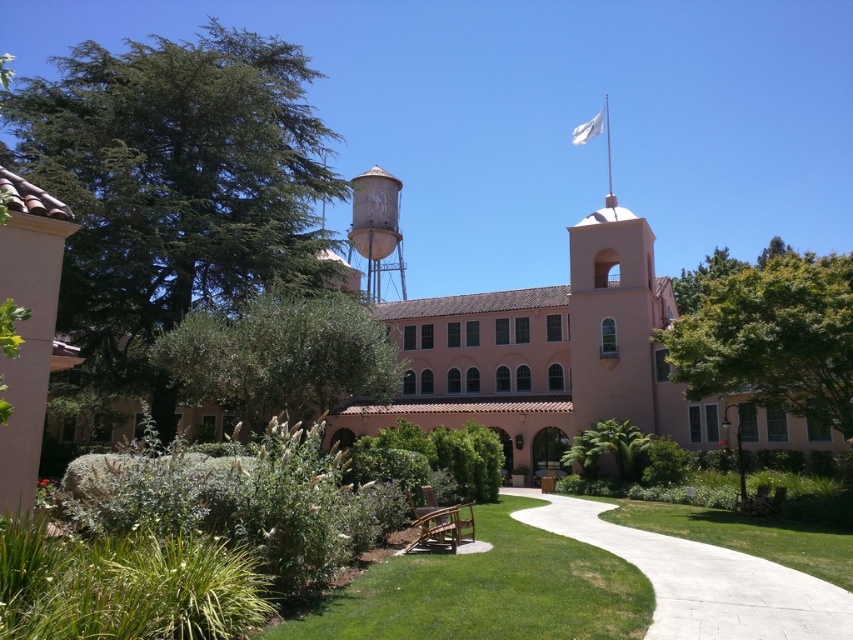
Can you confirm if white concrete path at lower center is bigger than green leafy bush at center?

No, white concrete path at lower center is not bigger than green leafy bush at center.

Consider the image. Which is more to the right, white concrete path at lower center or green leafy bush at center?

white concrete path at lower center

Is point (595, 540) positioned in front of point (444, 448)?

Yes, it is in front of point (444, 448).

In order to click on white concrete path at lower center in this screenshot , I will do `click(701, 579)`.

Is green grass at lower center above white fabric flag at upper center?

Actually, green grass at lower center is below white fabric flag at upper center.

Measure the distance from green grass at lower center to white fabric flag at upper center.

A distance of 38.98 meters exists between green grass at lower center and white fabric flag at upper center.

Who is more distant from viewer, (408, 577) or (595, 132)?

Point (595, 132)

Where is `green grass at lower center`? The width and height of the screenshot is (853, 640). green grass at lower center is located at coordinates (486, 592).

Who is more forward, (122, 195) or (386, 428)?

Point (122, 195) is more forward.

Looking at this image, does green leafy tree at left appear over green leafy bush at center?

Indeed, green leafy tree at left is positioned over green leafy bush at center.

Who is more distant from viewer, (x=271, y=179) or (x=413, y=435)?

Positioned behind is point (x=271, y=179).

Identify the location of green leafy tree at left. This screenshot has width=853, height=640. (173, 186).